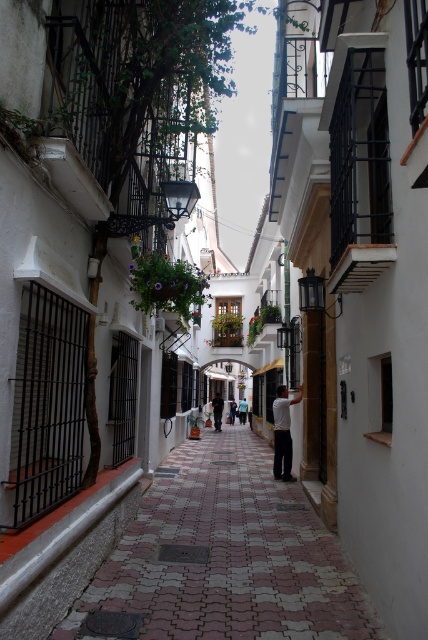
From the picture: Does dark gray pants at center have a lesser height compared to light blue shirt at center?

No.

Is dark gray pants at center to the left of light blue shirt at center from the viewer's perspective?

Yes, dark gray pants at center is to the left of light blue shirt at center.

Which is behind, point (216, 394) or point (240, 420)?

Point (216, 394)

Locate an element on the screen. The height and width of the screenshot is (640, 428). dark gray pants at center is located at coordinates (217, 410).

Does white matte shirt at center appear on the left side of dark gray pants at center?

Incorrect, white matte shirt at center is not on the left side of dark gray pants at center.

Measure the distance between point (291, 477) and camera.

The distance of point (291, 477) from camera is 12.34 meters.

Locate an element on the screen. This screenshot has width=428, height=640. white matte shirt at center is located at coordinates (282, 433).

Is white matte shirt at center shorter than light blue shirt at center?

No, white matte shirt at center is not shorter than light blue shirt at center.

Looking at this image, can you confirm if white matte shirt at center is smaller than light blue shirt at center?

Yes, white matte shirt at center is smaller than light blue shirt at center.

Where is `white matte shirt at center`? white matte shirt at center is located at coordinates (282, 433).